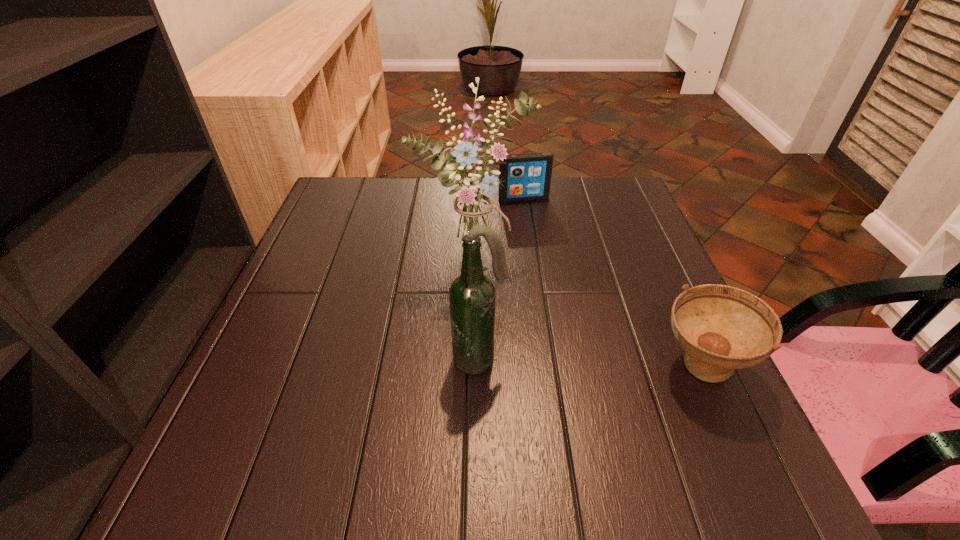
I want to click on vacant space located on the front-facing side of the bouquet, so click(566, 333).

This screenshot has width=960, height=540. What are the coordinates of `vacant position located on the front-facing side of the bouquet` in the screenshot? It's located at (549, 319).

Image resolution: width=960 pixels, height=540 pixels. I want to click on vacant region located 0.210m on the front-facing side of the bouquet, so click(577, 342).

At what (x,y) coordinates should I click in order to perform the action: click on object that is at the far edge. Please return your answer as a coordinate pair (x, y). The image size is (960, 540). Looking at the image, I should click on (527, 176).

Identify the location of object situated at the near edge. The width and height of the screenshot is (960, 540). (721, 328).

Locate an element on the screen. Image resolution: width=960 pixels, height=540 pixels. object at the right edge is located at coordinates 721,328.

What are the coordinates of `object that is at the near right corner` in the screenshot? It's located at click(x=721, y=328).

Where is `vacant space at the far edge of the desktop`? vacant space at the far edge of the desktop is located at coordinates (395, 185).

This screenshot has height=540, width=960. In the image, there is a desktop. Identify the location of blank space at the left edge. (278, 369).

I want to click on free space at the right edge of the desktop, so click(x=653, y=297).